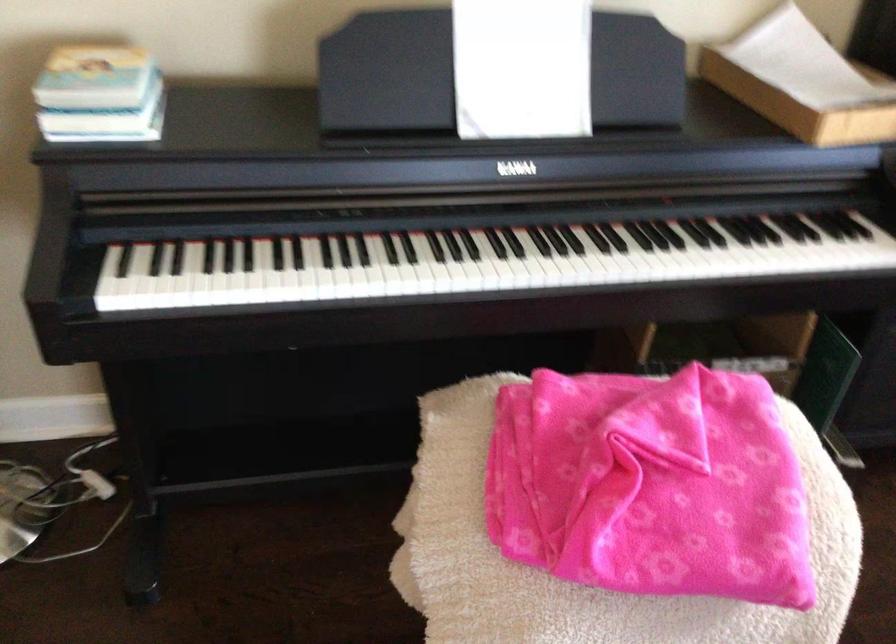
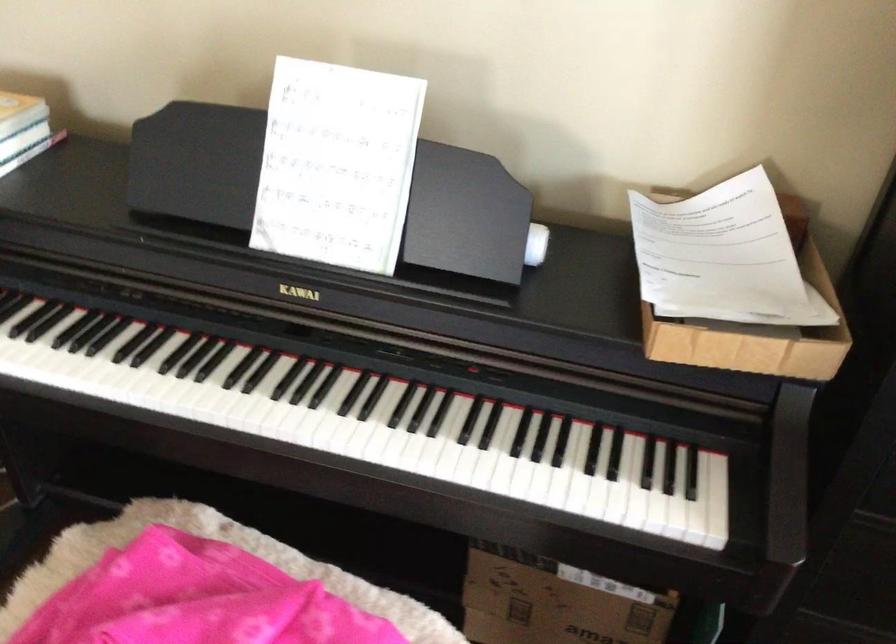
Question: The camera is either moving clockwise (left) or counter-clockwise (right) around the object. The first image is from the beginning of the video and the second image is from the end. Is the camera moving left or right when shooting the video?

Choices:
 (A) Left
 (B) Right

Answer: (B)